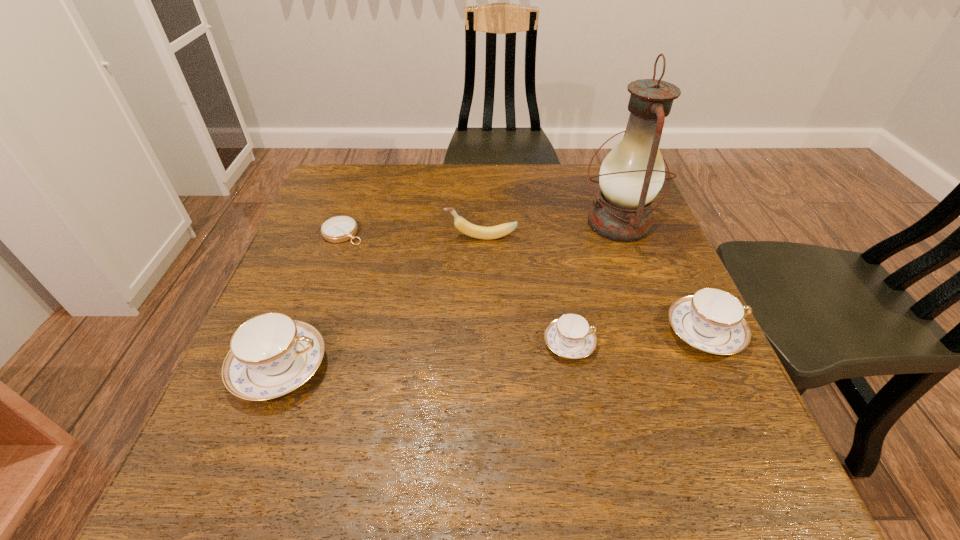
Identify the location of vacant space that satisfies the following two spatial constraints: 1. on the front side of the tallest object; 2. at the stem of the fourth object from right to left. This screenshot has height=540, width=960. (623, 238).